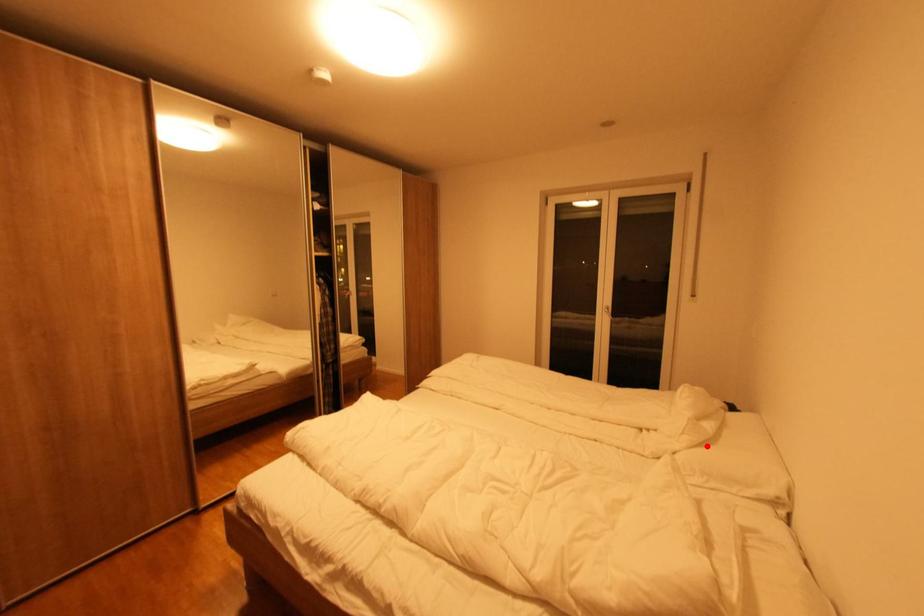
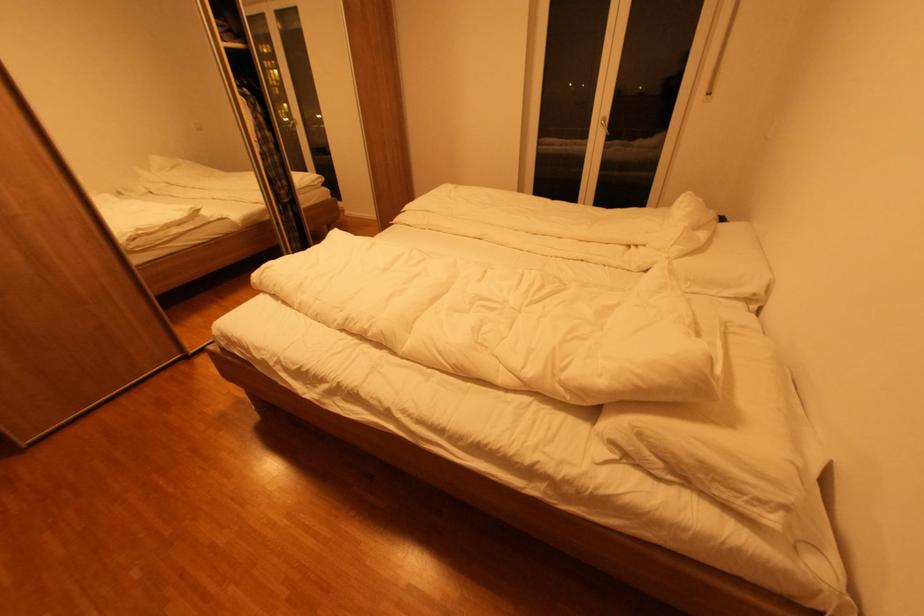
The point at the highlighted location is marked in the first image. Where is the corresponding point in the second image?

(697, 254)